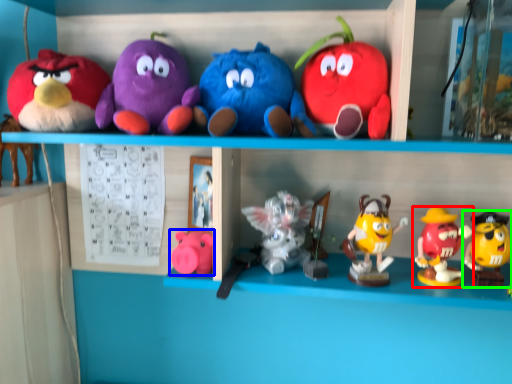
Question: Considering the real-world distances, which object is farthest from toy (highlighted by a red box)? toy (highlighted by a blue box) or toy (highlighted by a green box)?

Choices:
 (A) toy
 (B) toy

Answer: (A)